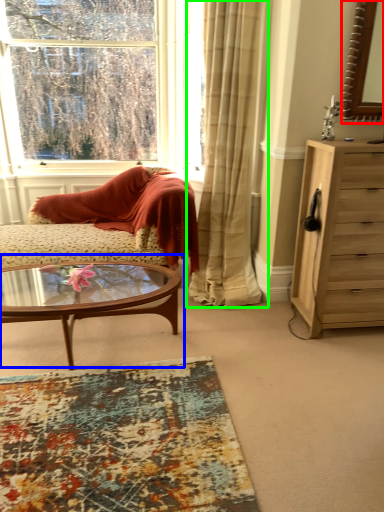
Question: Which object is positioned closest to mirror (highlighted by a red box)? Select from coffee table (highlighted by a blue box) and curtain (highlighted by a green box).

Choices:
 (A) coffee table
 (B) curtain

Answer: (B)